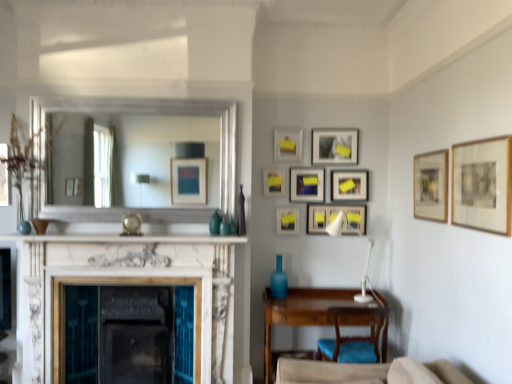
At what (x,y) coordinates should I click in order to perform the action: click on free spot above silver/metallic mirror at upper center (from a real-world perspective). Please return your answer as a coordinate pair (x, y). This screenshot has width=512, height=384. Looking at the image, I should click on (127, 92).